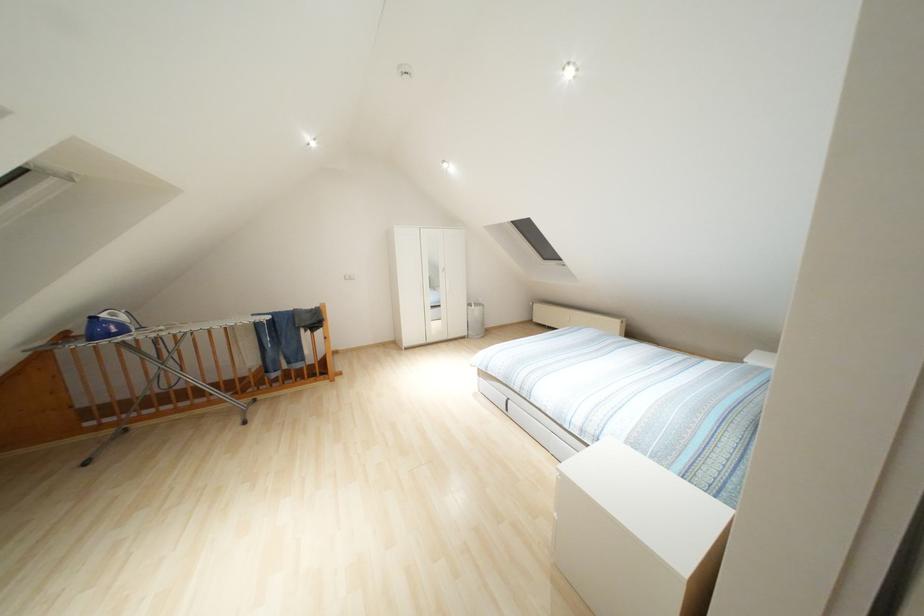
Where would you lift the silver wastebasket? Please return your answer as a coordinate pair (x, y).

(475, 320)